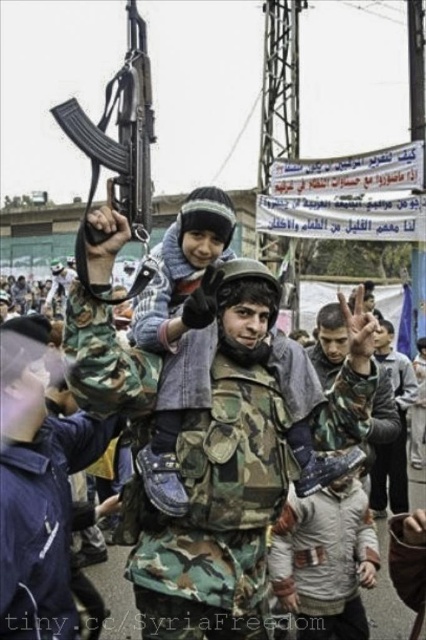
Is camouflage fabric uniform at lower left shorter than matte black rifle at upper left?

Correct, camouflage fabric uniform at lower left is not as tall as matte black rifle at upper left.

What are the coordinates of `camouflage fabric uniform at lower left` in the screenshot? It's located at (43, 524).

At what (x,y) coordinates should I click in order to perform the action: click on camouflage fabric uniform at lower left. Please return your answer as a coordinate pair (x, y). The width and height of the screenshot is (426, 640). Looking at the image, I should click on (43, 524).

Is camouflage-patterned jacket at center above camouflage uniform at center?

Indeed, camouflage-patterned jacket at center is positioned over camouflage uniform at center.

I want to click on camouflage-patterned jacket at center, so click(x=181, y=333).

At what (x,y) coordinates should I click in order to perform the action: click on camouflage-patterned jacket at center. Please return your answer as a coordinate pair (x, y). The height and width of the screenshot is (640, 426). Looking at the image, I should click on (181, 333).

Is camouflage-patterned jacket at center bigger than camouflage jacket at center?

Yes.

Measure the distance between point [166,289] and camera.

Point [166,289] is 86.09 meters away from camera.

Is point (152, 465) behind point (330, 508)?

That is False.

Identify the location of camouflage-patterned jacket at center. This screenshot has width=426, height=640. (181, 333).